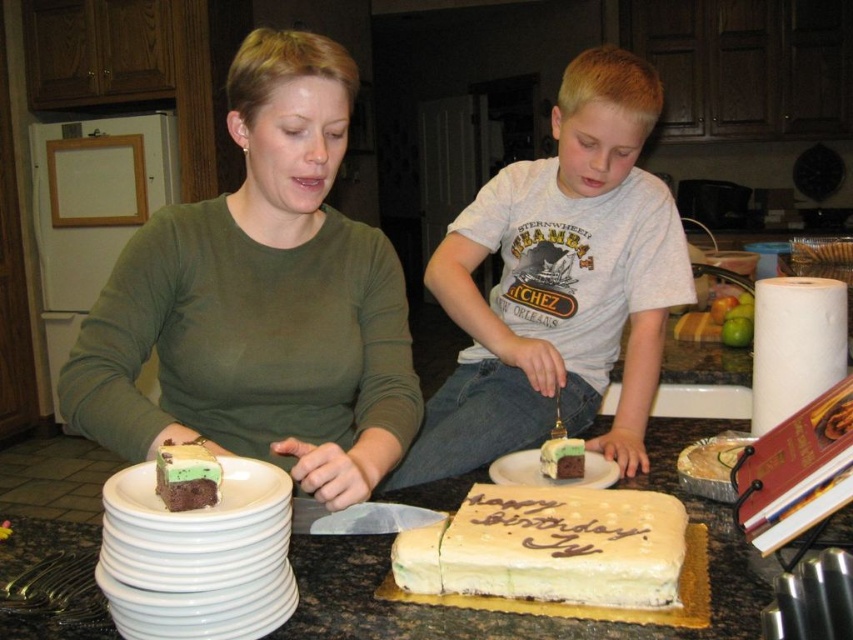
Question: Is white cotton shirt at center in front of green frosted cake at center?

Choices:
 (A) no
 (B) yes

Answer: (A)

Question: Which object is positioned farthest from the green frosted cake at center?

Choices:
 (A) white frosted rectangular cake at center
 (B) white ceramic plate at center
 (C) white cotton shirt at center
 (D) chocolatesmoothcake at center

Answer: (D)

Question: Which is farther from the white ceramic plate at lower left?

Choices:
 (A) matte green shirt at center
 (B) white frosted rectangular cake at center
 (C) green frosted cake at center
 (D) white ceramic plate at center

Answer: (C)

Question: Does matte green shirt at center have a greater width compared to white ceramic plate at lower left?

Choices:
 (A) no
 (B) yes

Answer: (B)

Question: Does chocolatesmoothcake at center appear on the right side of green frosted cake at center?

Choices:
 (A) yes
 (B) no

Answer: (B)

Question: Which point is farther to the camera?

Choices:
 (A) white frosted rectangular cake at center
 (B) white ceramic plate at lower left
 (C) white cotton shirt at center
 (D) matte green shirt at center

Answer: (C)